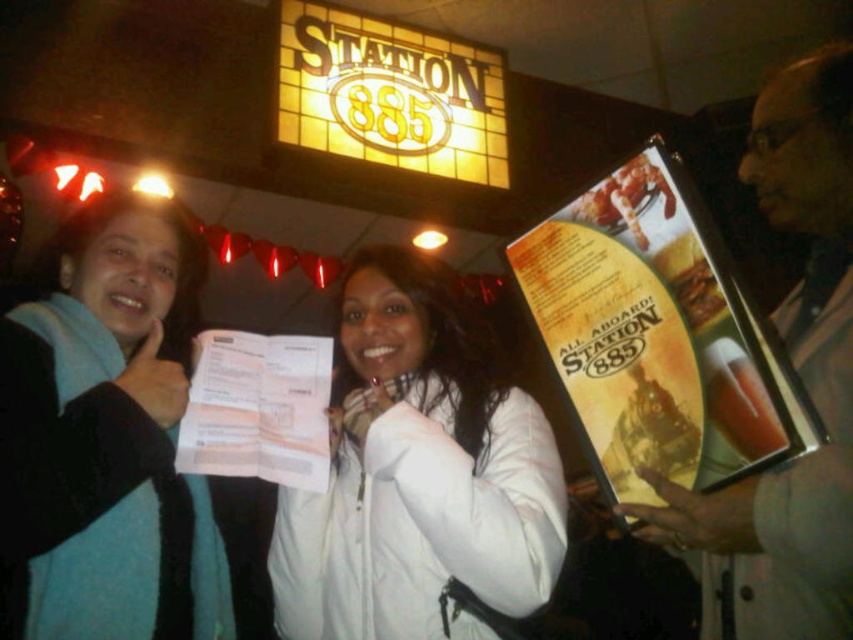
Can you confirm if yellow paper menu at center is smaller than matte plastic menu at right?

Yes, yellow paper menu at center is smaller than matte plastic menu at right.

Which is below, yellow paper menu at center or matte plastic menu at right?

matte plastic menu at right is lower down.

Who is more distant from viewer, (654, 177) or (792, 307)?

Positioned behind is point (654, 177).

Find the location of a particular element. Image resolution: width=853 pixels, height=640 pixels. yellow paper menu at center is located at coordinates (656, 336).

Is teal sweater at left bigger than matte plastic menu at right?

Indeed, teal sweater at left has a larger size compared to matte plastic menu at right.

Does teal sweater at left appear on the left side of matte plastic menu at right?

Indeed, teal sweater at left is positioned on the left side of matte plastic menu at right.

Where is `teal sweater at left`? This screenshot has width=853, height=640. teal sweater at left is located at coordinates (108, 436).

Where is `teal sweater at left`? Image resolution: width=853 pixels, height=640 pixels. teal sweater at left is located at coordinates (108, 436).

Between white matte jacket at center and teal sweater at left, which one appears on the left side from the viewer's perspective?

Positioned to the left is teal sweater at left.

Is white matte jacket at center bigger than teal sweater at left?

Indeed, white matte jacket at center has a larger size compared to teal sweater at left.

Does point (434, 620) come closer to viewer compared to point (161, 536)?

Yes.

Identify the location of white matte jacket at center. (419, 472).